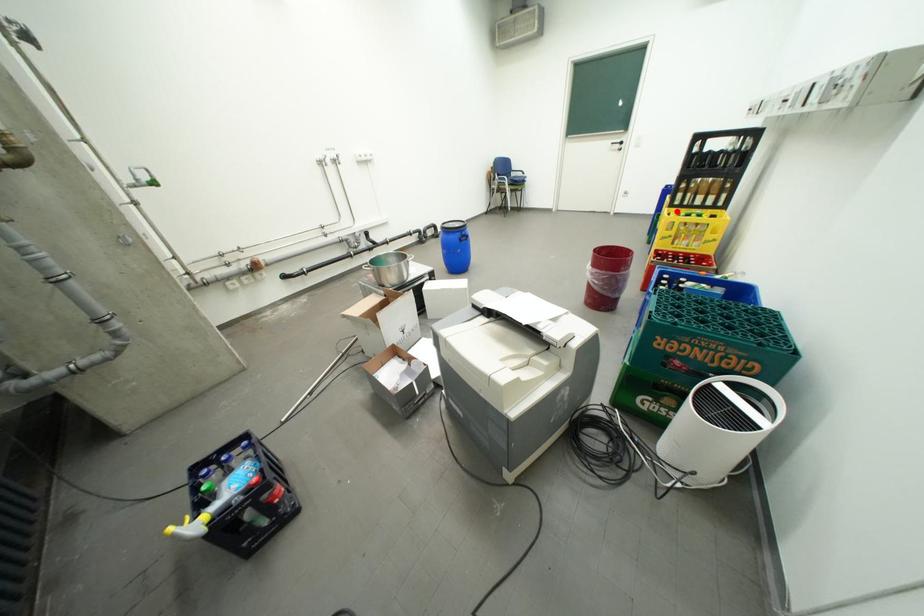
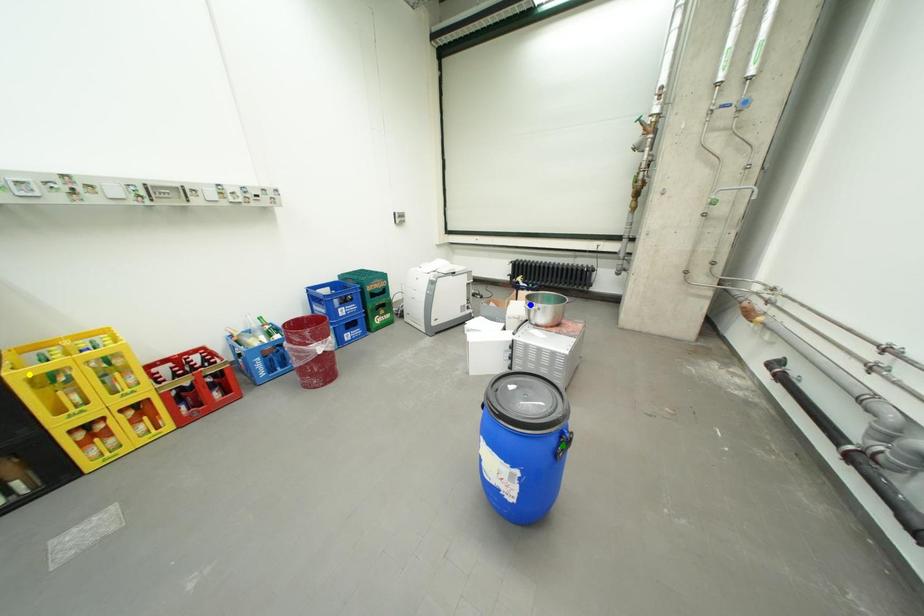
Question: I am providing you with two images of the same scene from different viewpoints. A red point is marked on the first image. You are given multiple points on the second image. In image 2, which mark is for the same physical point as the one in image 1?

Choices:
 (A) blue point
 (B) green point
 (C) yellow point

Answer: (C)